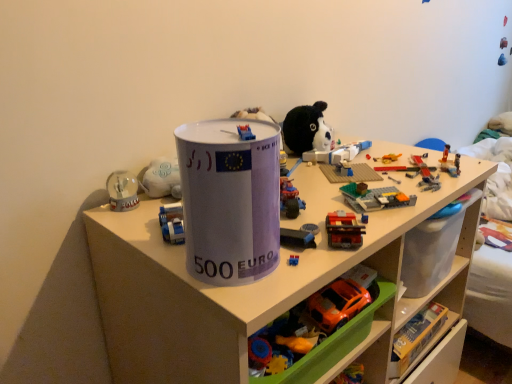
Question: From the image's perspective, is white plastic shelf at center located above or below orange plastic car at lower center, the fourth toy positioned from the top?

Choices:
 (A) below
 (B) above

Answer: (A)

Question: Based on their positions, is white plastic shelf at center located to the left or right of orange plastic car at lower center, the first toy in the bottom-to-top sequence?

Choices:
 (A) left
 (B) right

Answer: (B)

Question: Based on their relative distances, which object is farther from the white plastic shelf at center?

Choices:
 (A) white paper cup at center
 (B) orange plastic car at lower center, the first toy in the bottom-to-top sequence
 (C) orange plastic car at lower center, which is the third toy from top to bottom
 (D) rubberized plastic toy car at center, which is the 1th toy from top to bottom
 (E) brick-like plastic train at center-right, the second toy positioned from the top

Answer: (E)

Question: Based on their relative distances, which object is nearer to the brick-like plastic train at center-right, the second toy positioned from the top?

Choices:
 (A) rubberized plastic toy car at center, which appears as the 4th toy when ordered from the bottom
 (B) orange plastic car at lower center, the 2th toy positioned from the bottom
 (C) white paper cup at center
 (D) orange plastic car at lower center, the fourth toy positioned from the top
 (E) white plastic shelf at center

Answer: (A)